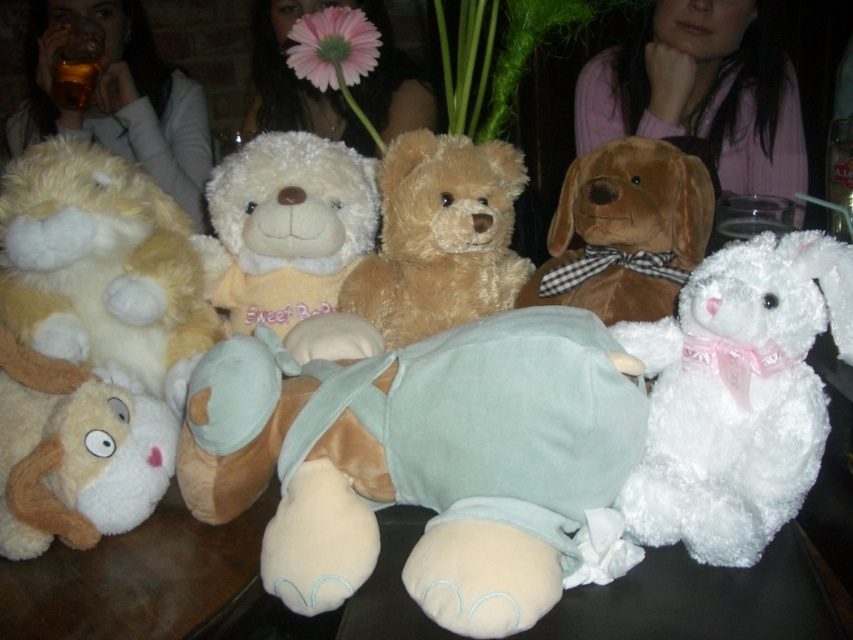
Question: Which of these objects is positioned closest to the fuzzy brown teddy bear at center?

Choices:
 (A) white plush teddy bear at center
 (B) fluffy beige dog at lower left

Answer: (A)

Question: Which of the following is the closest to the observer?

Choices:
 (A) (251, 220)
 (B) (119, 522)

Answer: (B)

Question: Does fuzzy brown teddy bear at center appear under brown plush dog at center?

Choices:
 (A) no
 (B) yes

Answer: (A)

Question: Does light blue plush toy at center appear on the right side of fluffy beige teddy bear at left?

Choices:
 (A) yes
 (B) no

Answer: (A)

Question: Which point is farther to the camera?

Choices:
 (A) white plush teddy bear at center
 (B) light blue plush toy at center
 (C) fluffy beige dog at lower left
 (D) fluffy beige teddy bear at left

Answer: (A)

Question: Does light blue plush toy at center have a greater width compared to brown plush dog at center?

Choices:
 (A) no
 (B) yes

Answer: (B)